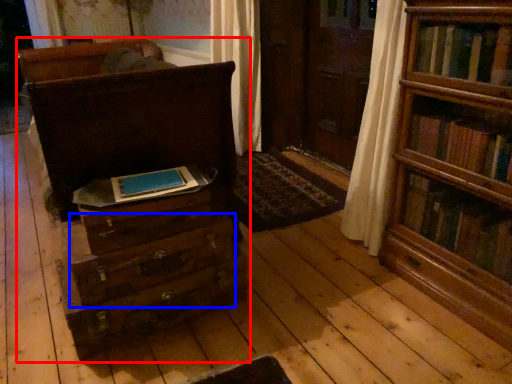
Question: Which object appears closest to the camera in this image, chest of drawers (highlighted by a red box) or drawer (highlighted by a blue box)?

Choices:
 (A) chest of drawers
 (B) drawer

Answer: (A)